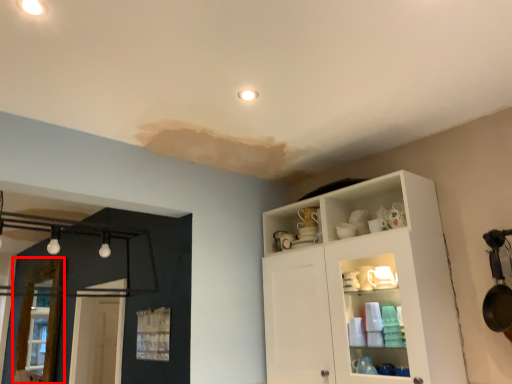
Question: From the image's perspective, what is the correct spatial positioning of screen door (annotated by the red box) in reference to cupboard?

Choices:
 (A) above
 (B) below

Answer: (B)